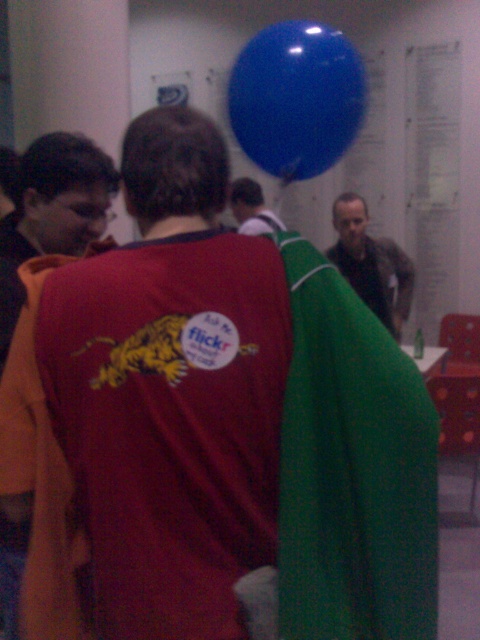
You are at a social event and want to take a photo of the matte red shirt at center without the glossy blue balloon at upper center appearing in the shot. Can you angle your camera downward to achieve this?

The glossy blue balloon at upper center is thinner than the matte red shirt at center, so angling the camera downward might help avoid the balloon since it is narrower and positioned above the shirt.

You are a photographer at the event and want to capture a photo that includes both the glossy blue balloon at upper center and the matte brown jacket at center. The camera has a maximum focus range of 8 feet. Will both objects be in focus?

The glossy blue balloon at upper center is 7.81 feet away from the matte brown jacket at center. Since the distance between them is within the camera maximum focus range of 8 feet, both objects will be in focus.

You are a photographer at the event and want to take a photo of both the matte brown jacket at center and the smooth gray shirt at center in the same frame. The camera has a minimum focus distance of 23 inches. Can you capture both subjects clearly without moving the camera or the subjects?

The matte brown jacket at center and smooth gray shirt at center are 22.89 inches apart, which is less than the camera minimum focus distance of 23 inches. Therefore, the camera can capture both subjects clearly in the same frame without needing to move anything.